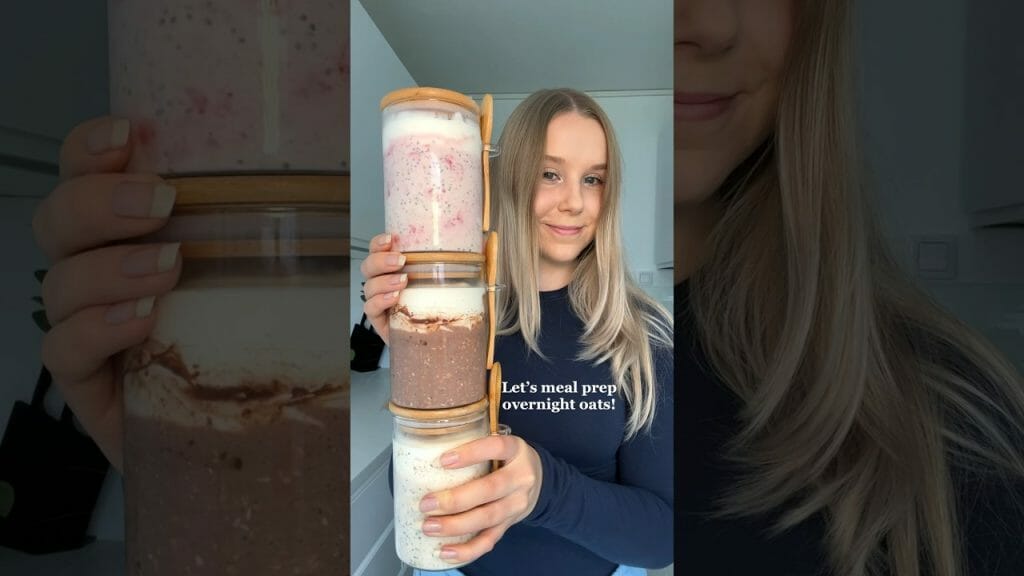
You are a GUI agent. You are given a task and a screenshot of the screen. Output one action in this format:
    pyautogui.click(x=<x>, y=<y>)
    Task: Click on the white counter top
    
    Given the screenshot: What is the action you would take?
    pyautogui.click(x=375, y=442)